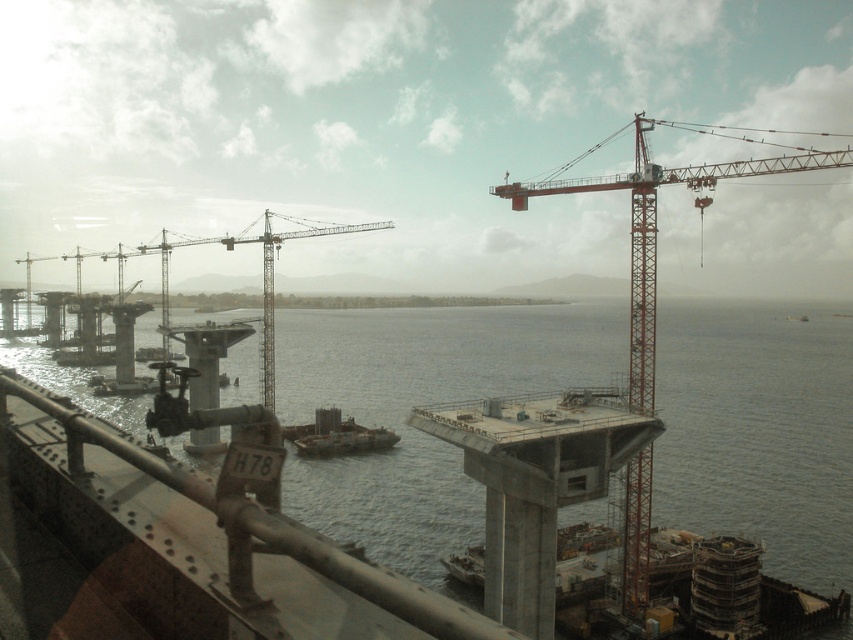
Who is taller, gray concrete water at center or rusty metal rail at lower left?

gray concrete water at center is taller.

What are the coordinates of `gray concrete water at center` in the screenshot? It's located at click(418, 403).

Which is above, rusty metal rail at lower left or red metal crane at upper right?

red metal crane at upper right

Can you confirm if rusty metal rail at lower left is shorter than red metal crane at upper right?

Correct, rusty metal rail at lower left is not as tall as red metal crane at upper right.

Who is more forward, (73, 596) or (630, 186)?

Positioned in front is point (73, 596).

Locate an element on the screen. rusty metal rail at lower left is located at coordinates (178, 541).

Which of these two, red metal crane at upper right or metallic gray boat at center, stands shorter?

metallic gray boat at center

Consider the image. Can you confirm if red metal crane at upper right is smaller than metallic gray boat at center?

Actually, red metal crane at upper right might be larger than metallic gray boat at center.

The image size is (853, 640). What are the coordinates of `red metal crane at upper right` in the screenshot? It's located at (656, 225).

Locate an element on the screen. Image resolution: width=853 pixels, height=640 pixels. red metal crane at upper right is located at coordinates (656, 225).